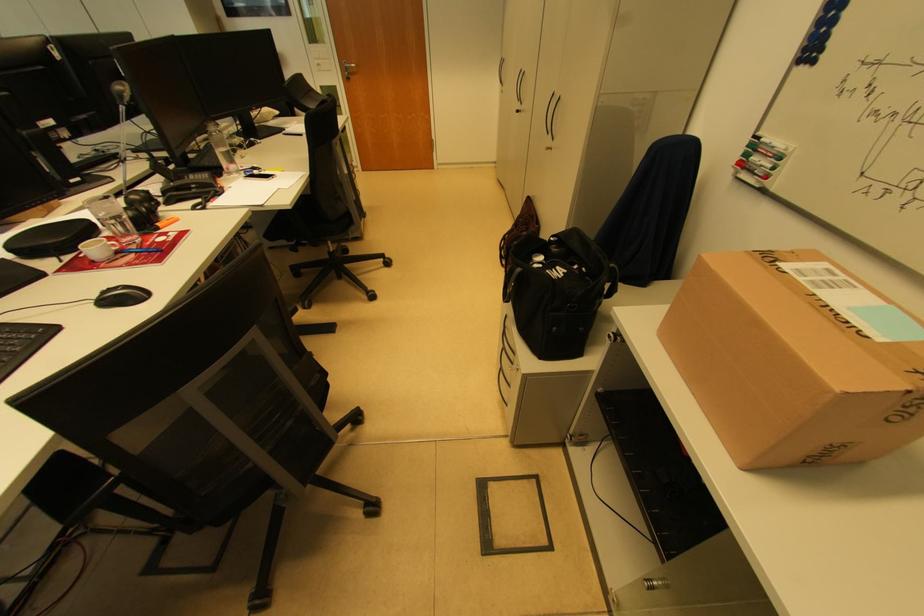
At what (x,y) coordinates should I click in order to perform the action: click on silver door handle. Please return your answer as a coordinate pair (x, y). Looking at the image, I should click on (553, 118).